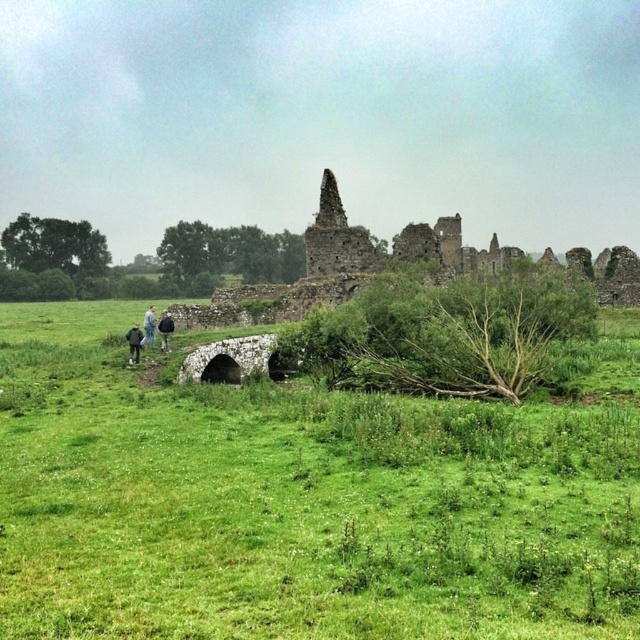
Is camouflage jacket at left above dark blue jeans at lower left?

Correct, camouflage jacket at left is located above dark blue jeans at lower left.

Does camouflage jacket at left appear on the right side of dark blue jeans at lower left?

Yes, camouflage jacket at left is to the right of dark blue jeans at lower left.

Is point (141, 346) closer to camera compared to point (136, 349)?

No.

You are a GUI agent. You are given a task and a screenshot of the screen. Output one action in this format:
    pyautogui.click(x=<x>, y=<y>)
    Task: Click on the camouflage jacket at left
    
    Given the screenshot: What is the action you would take?
    pyautogui.click(x=148, y=326)

Which is behind, point (428, 588) or point (150, 332)?

The point (150, 332) is behind.

Between point (10, 560) and point (152, 326), which one is positioned in front?

Point (10, 560)

This screenshot has height=640, width=640. I want to click on green grassy field at center, so click(301, 500).

Between green grassy field at center and dark blue jeans at lower left, which one appears on the left side from the viewer's perspective?

dark blue jeans at lower left

Between point (26, 374) and point (131, 353), which one is positioned behind?

The point (131, 353) is behind.

Between point (305, 506) and point (134, 348), which one is positioned behind?

Point (134, 348)

The width and height of the screenshot is (640, 640). What are the coordinates of `green grassy field at center` in the screenshot? It's located at (301, 500).